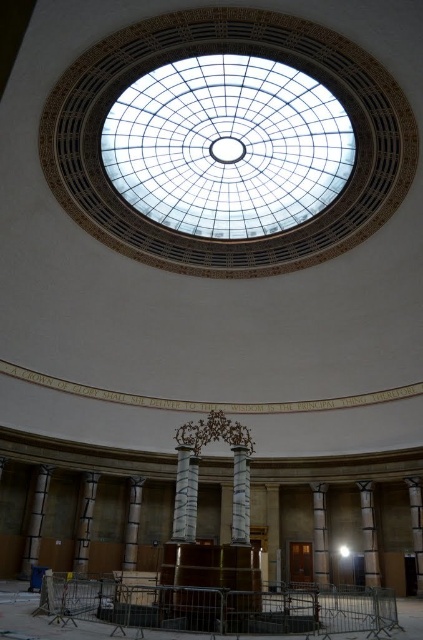
Is sanded wood pillar at right above smooth white column at lower left?

Incorrect, sanded wood pillar at right is not positioned above smooth white column at lower left.

In order to click on sanded wood pillar at right in this screenshot , I will do `click(368, 534)`.

Describe the element at coordinates (368, 534) in the screenshot. I see `sanded wood pillar at right` at that location.

The width and height of the screenshot is (423, 640). What are the coordinates of `sanded wood pillar at right` in the screenshot? It's located at (368, 534).

Is sanded concrete pillar at center below slate stone column at center?

Correct, sanded concrete pillar at center is located below slate stone column at center.

How much distance is there between sanded concrete pillar at center and slate stone column at center?

sanded concrete pillar at center is 43.65 meters away from slate stone column at center.

Does point (84, 476) lie behind point (417, 516)?

Yes, point (84, 476) is behind point (417, 516).

Locate an element on the screen. sanded concrete pillar at center is located at coordinates (85, 522).

Measure the distance from satin silver column at center to sanded concrete pillar at center.

105.82 feet

Which is above, satin silver column at center or sanded concrete pillar at center?

sanded concrete pillar at center is higher up.

I want to click on satin silver column at center, so click(x=320, y=534).